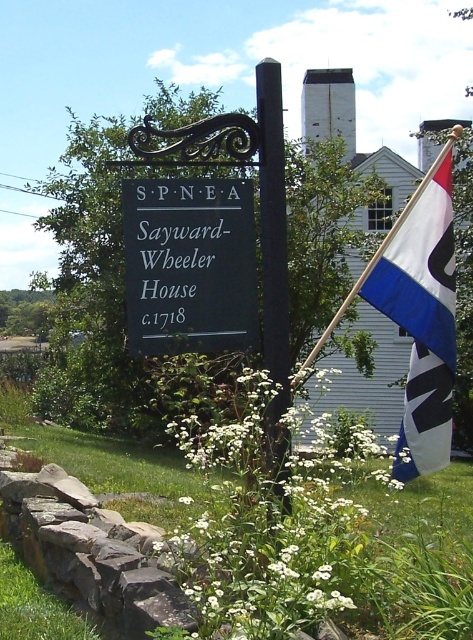
You are a tour guide leading a group to the historical marker. You want to point out both the black matte sign at center and the blue and white fabric flag at right. How far apart are these two landmarks in inches?

The black matte sign at center is 31.53 inches from the blue and white fabric flag at right.

You are a visitor at the historical site and want to take a photo of both the blue and white fabric flag at right and the black wood pole at center. Which object should you focus on first to ensure both are in frame?

You should focus on the black wood pole at center first because the blue and white fabric flag at right is taller than the black wood pole at center, so adjusting the camera angle to include the taller flag will naturally include the shorter pole as well.

You are standing at the center of the image and want to locate the black matte sign at center. According to the coordinates provided, is the sign closer to the top or bottom of the image?

The black matte sign at center is located at coordinates point 0.402 on the vertical axis, which is closer to the bottom of the image since 0.402 is less than 0.5.